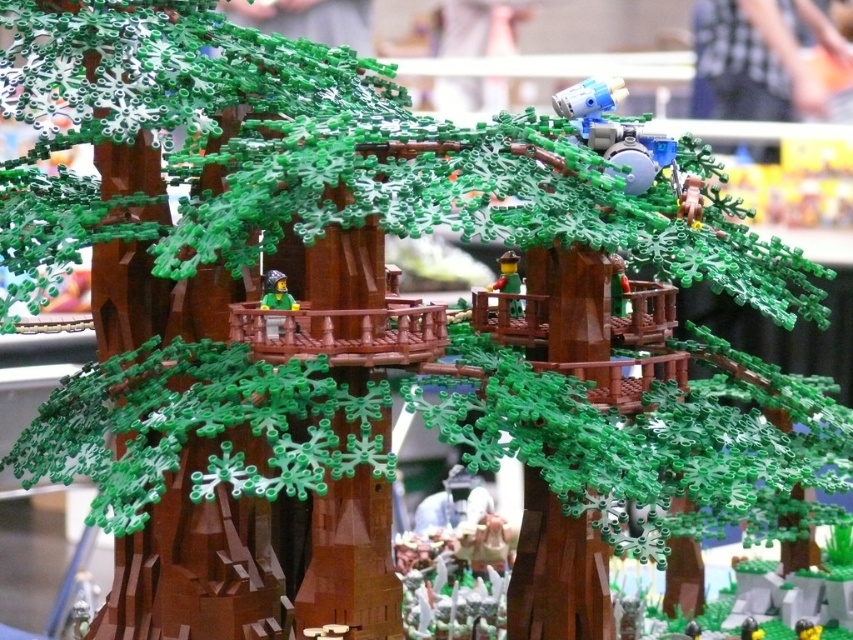
Question: Which point appears closest to the camera in this image?

Choices:
 (A) (264, 284)
 (B) (509, 276)

Answer: (A)

Question: Where is green matte minifigure at center located in relation to smooth brown figure at center in the image?

Choices:
 (A) right
 (B) left

Answer: (B)

Question: Does green matte minifigure at center have a larger size compared to smooth brown figure at center?

Choices:
 (A) yes
 (B) no

Answer: (B)

Question: Is green matte minifigure at center to the left of smooth brown figure at center from the viewer's perspective?

Choices:
 (A) yes
 (B) no

Answer: (A)